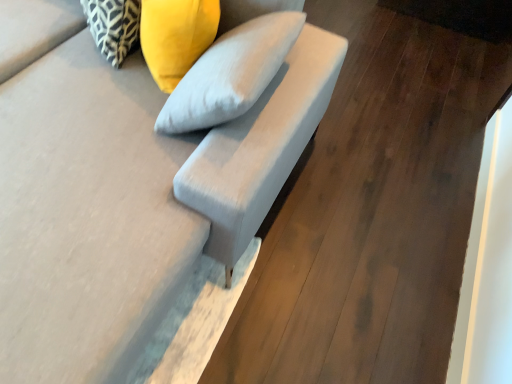
Question: Is patterned fabric pillow at upper left, acting as the 2th pillow starting from the right, aimed at suede gray sofa at center?

Choices:
 (A) no
 (B) yes

Answer: (B)

Question: From the image's perspective, is patterned fabric pillow at upper left, acting as the first pillow starting from the left, below suede gray sofa at center?

Choices:
 (A) no
 (B) yes

Answer: (A)

Question: From a real-world perspective, is patterned fabric pillow at upper left, acting as the 2th pillow starting from the right, located beneath suede gray sofa at center?

Choices:
 (A) no
 (B) yes

Answer: (A)

Question: Are patterned fabric pillow at upper left, acting as the first pillow starting from the left, and suede gray sofa at center beside each other?

Choices:
 (A) yes
 (B) no

Answer: (B)

Question: Can you confirm if patterned fabric pillow at upper left, acting as the first pillow starting from the left, is shorter than suede gray sofa at center?

Choices:
 (A) no
 (B) yes

Answer: (B)

Question: Is yellow fabric pillow at upper center, which ranks as the second pillow in left-to-right order, taller or shorter than suede-like gray armchair at center?

Choices:
 (A) short
 (B) tall

Answer: (A)

Question: From the image's perspective, is yellow fabric pillow at upper center, which ranks as the second pillow in left-to-right order, above or below suede-like gray armchair at center?

Choices:
 (A) below
 (B) above

Answer: (B)

Question: Is yellow fabric pillow at upper center, which ranks as the second pillow in left-to-right order, to the left or to the right of suede-like gray armchair at center in the image?

Choices:
 (A) left
 (B) right

Answer: (A)

Question: Is yellow fabric pillow at upper center, which ranks as the second pillow in left-to-right order, spatially inside suede-like gray armchair at center, or outside of it?

Choices:
 (A) outside
 (B) inside

Answer: (B)

Question: From their relative heights in the image, would you say suede-like gray armchair at center is taller or shorter than patterned fabric pillow at upper left, acting as the 2th pillow starting from the right?

Choices:
 (A) short
 (B) tall

Answer: (B)

Question: From a real-world perspective, is suede-like gray armchair at center above or below patterned fabric pillow at upper left, acting as the first pillow starting from the left?

Choices:
 (A) below
 (B) above

Answer: (B)

Question: Considering their positions, is suede-like gray armchair at center located in front of or behind patterned fabric pillow at upper left, acting as the first pillow starting from the left?

Choices:
 (A) behind
 (B) front

Answer: (B)

Question: Considering the positions of suede-like gray armchair at center and patterned fabric pillow at upper left, acting as the first pillow starting from the left, in the image, is suede-like gray armchair at center wider or thinner than patterned fabric pillow at upper left, acting as the first pillow starting from the left,?

Choices:
 (A) wide
 (B) thin

Answer: (A)

Question: Considering the positions of suede-like gray armchair at center and suede gray sofa at center in the image, is suede-like gray armchair at center taller or shorter than suede gray sofa at center?

Choices:
 (A) tall
 (B) short

Answer: (B)

Question: From the image's perspective, is suede-like gray armchair at center positioned above or below suede gray sofa at center?

Choices:
 (A) above
 (B) below

Answer: (A)